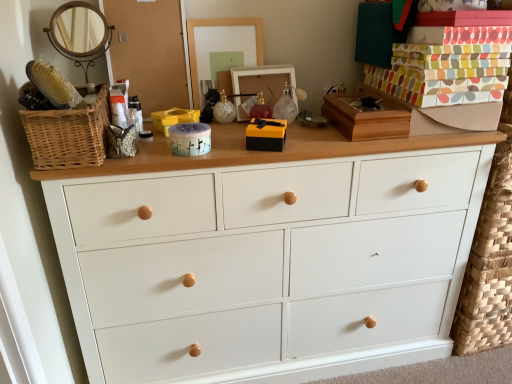
Question: In terms of height, does white painted wood chest of drawers at center look taller or shorter compared to woven wood basket at left?

Choices:
 (A) short
 (B) tall

Answer: (B)

Question: Looking at the image, does white painted wood chest of drawers at center seem bigger or smaller compared to woven wood basket at left?

Choices:
 (A) small
 (B) big

Answer: (B)

Question: Which of these objects is positioned closest to the white painted wood chest of drawers at center?

Choices:
 (A) woven wood basket at left
 (B) wooden picture frame at center
 (C) yellow plastic storage box at center
 (D) matte wooden mirror at upper center
 (E) yellow matte/black textured box at center, which ranks as the second box in right-to-left order

Answer: (E)

Question: Which object is positioned farthest from the yellow matte/black textured box at center, which ranks as the second box in right-to-left order?

Choices:
 (A) translucent plastic tube at center
 (B) wooden picture frame at center
 (C) woven wood basket at left
 (D) matte glass ornament at center
 (E) matte purple container at center, positioned as the third box in right-to-left order

Answer: (C)